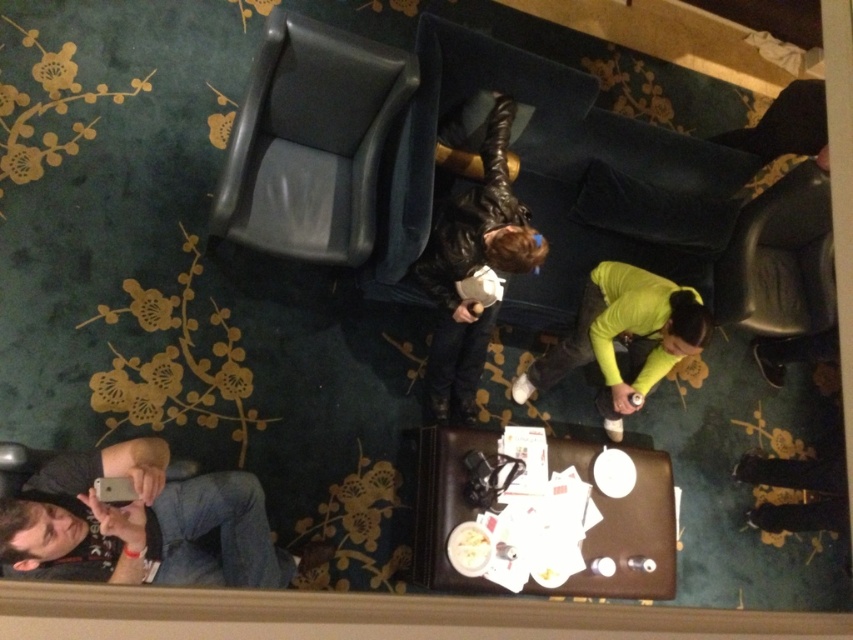
From the picture: Which is more to the left, matte black chair at upper left or brown leather luggage at center?

Positioned to the left is matte black chair at upper left.

Which is behind, point (331, 147) or point (421, 556)?

Positioned behind is point (331, 147).

Image resolution: width=853 pixels, height=640 pixels. I want to click on matte black chair at upper left, so click(x=310, y=141).

Which is in front, point (799, 230) or point (643, 360)?

Positioned in front is point (643, 360).

Is black leather chair at right wider than neon yellow long-sleeve shirt at center?

Incorrect, black leather chair at right's width does not surpass neon yellow long-sleeve shirt at center's.

The image size is (853, 640). I want to click on black leather chair at right, so click(780, 259).

Between point (421, 525) and point (791, 298), which one is positioned behind?

Point (791, 298)

Can you confirm if brown leather luggage at center is positioned below black leather chair at right?

Yes, brown leather luggage at center is below black leather chair at right.

The image size is (853, 640). I want to click on brown leather luggage at center, so click(x=631, y=536).